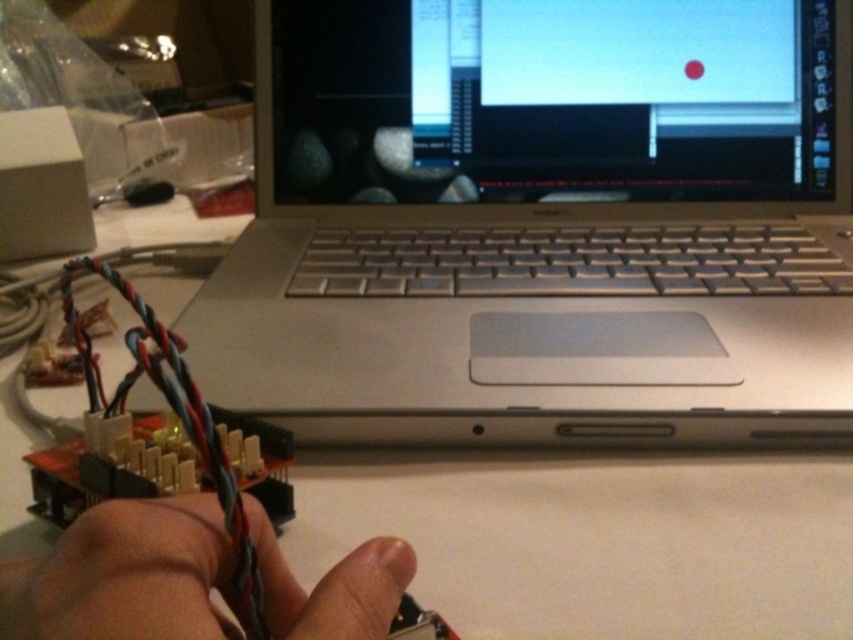
Does silver metallic laptop at center have a lesser width compared to skinny wire at lower left?

In fact, silver metallic laptop at center might be wider than skinny wire at lower left.

Does silver metallic laptop at center appear on the left side of skinny wire at lower left?

No, silver metallic laptop at center is not to the left of skinny wire at lower left.

Who is more forward, [523,358] or [335,614]?

Point [335,614]

Find the location of a particular element. silver metallic laptop at center is located at coordinates (543, 225).